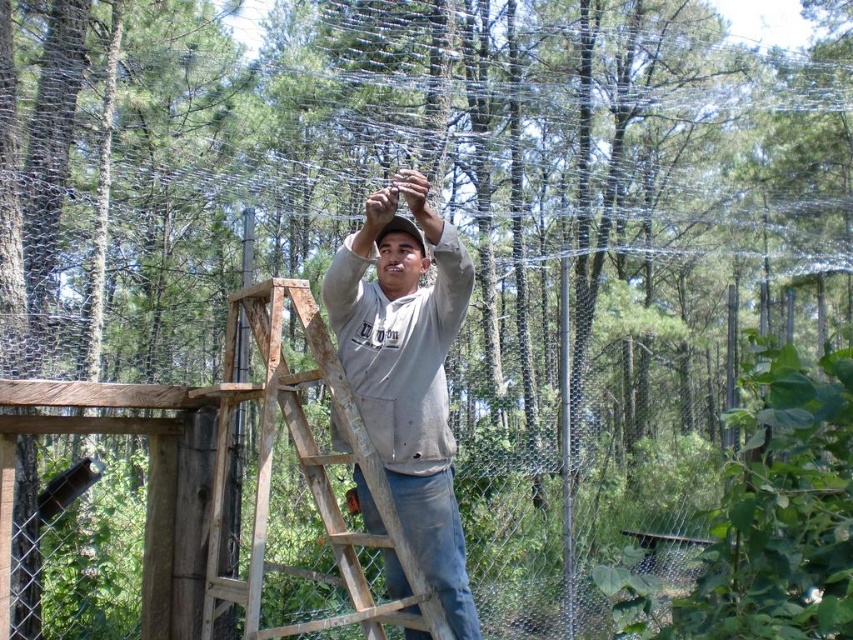
Can you confirm if gray sweatshirt at center is shorter than wooden at center?

No.

Does gray sweatshirt at center appear on the left side of wooden at center?

In fact, gray sweatshirt at center is to the right of wooden at center.

Is point (389, 371) closer to camera compared to point (300, 433)?

No, it is not.

Identify the location of gray sweatshirt at center. The height and width of the screenshot is (640, 853). (407, 371).